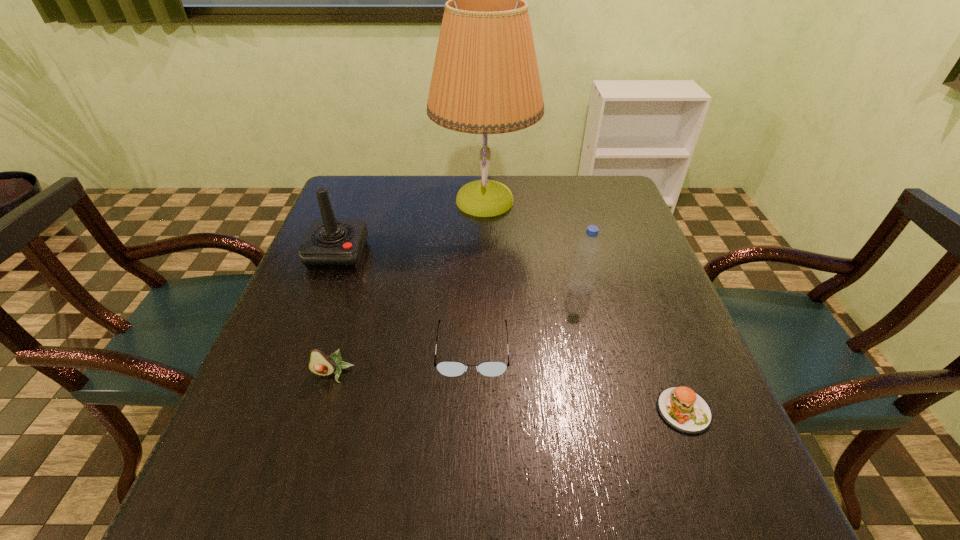
Locate an element on the screen. Image resolution: width=960 pixels, height=540 pixels. object that is at the right edge is located at coordinates (683, 409).

What are the coordinates of `vacant space at the far edge of the desktop` in the screenshot? It's located at pyautogui.click(x=502, y=176).

The width and height of the screenshot is (960, 540). What are the coordinates of `vacant space at the near edge of the desktop` in the screenshot? It's located at (544, 507).

You are a GUI agent. You are given a task and a screenshot of the screen. Output one action in this format:
    pyautogui.click(x=<x>, y=<y>)
    Task: Click on the vacant point at the left edge
    This screenshot has width=960, height=540.
    Given the screenshot: What is the action you would take?
    pyautogui.click(x=313, y=440)

The width and height of the screenshot is (960, 540). I want to click on free space at the right edge of the desktop, so click(x=661, y=453).

Locate an element on the screen. Image resolution: width=960 pixels, height=540 pixels. vacant space at the far left corner of the desktop is located at coordinates (332, 204).

In the image, there is a desktop. Find the location of `blank space at the near left corner`. blank space at the near left corner is located at coordinates (233, 481).

Image resolution: width=960 pixels, height=540 pixels. Identify the location of vacant space at the far right corner of the desktop. (609, 203).

Where is `blank space at the near right corner of the desktop`? blank space at the near right corner of the desktop is located at coordinates (689, 504).

Locate an element on the screen. unoccupied area between the joystick and the shortest object is located at coordinates (511, 332).